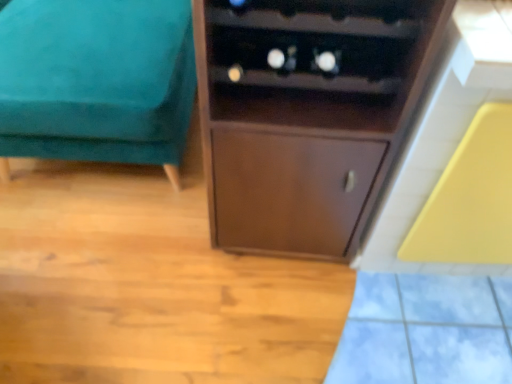
Question: Could you tell me if brown wood cupboard at center is turned towards teal velvet ottoman at left?

Choices:
 (A) no
 (B) yes

Answer: (A)

Question: Would you consider brown wood cupboard at center to be distant from teal velvet ottoman at left?

Choices:
 (A) yes
 (B) no

Answer: (B)

Question: From a real-world perspective, is brown wood cupboard at center located beneath teal velvet ottoman at left?

Choices:
 (A) yes
 (B) no

Answer: (B)

Question: From a real-world perspective, is brown wood cupboard at center on top of teal velvet ottoman at left?

Choices:
 (A) no
 (B) yes

Answer: (B)

Question: Is brown wood cupboard at center wider than teal velvet ottoman at left?

Choices:
 (A) yes
 (B) no

Answer: (B)

Question: Can we say brown wood cupboard at center lies outside teal velvet ottoman at left?

Choices:
 (A) yes
 (B) no

Answer: (A)

Question: Does teal velvet ottoman at left come in front of brown wood cupboard at center?

Choices:
 (A) no
 (B) yes

Answer: (A)

Question: Does teal velvet ottoman at left have a lesser height compared to brown wood cupboard at center?

Choices:
 (A) no
 (B) yes

Answer: (B)

Question: Is teal velvet ottoman at left taller than brown wood cupboard at center?

Choices:
 (A) yes
 (B) no

Answer: (B)

Question: From the image's perspective, is teal velvet ottoman at left on brown wood cupboard at center?

Choices:
 (A) yes
 (B) no

Answer: (A)

Question: Does teal velvet ottoman at left have a lesser width compared to brown wood cupboard at center?

Choices:
 (A) yes
 (B) no

Answer: (B)

Question: Is brown wood cupboard at center at the back of teal velvet ottoman at left?

Choices:
 (A) no
 (B) yes

Answer: (A)

Question: Is brown wood cupboard at center bigger or smaller than teal velvet ottoman at left?

Choices:
 (A) big
 (B) small

Answer: (B)